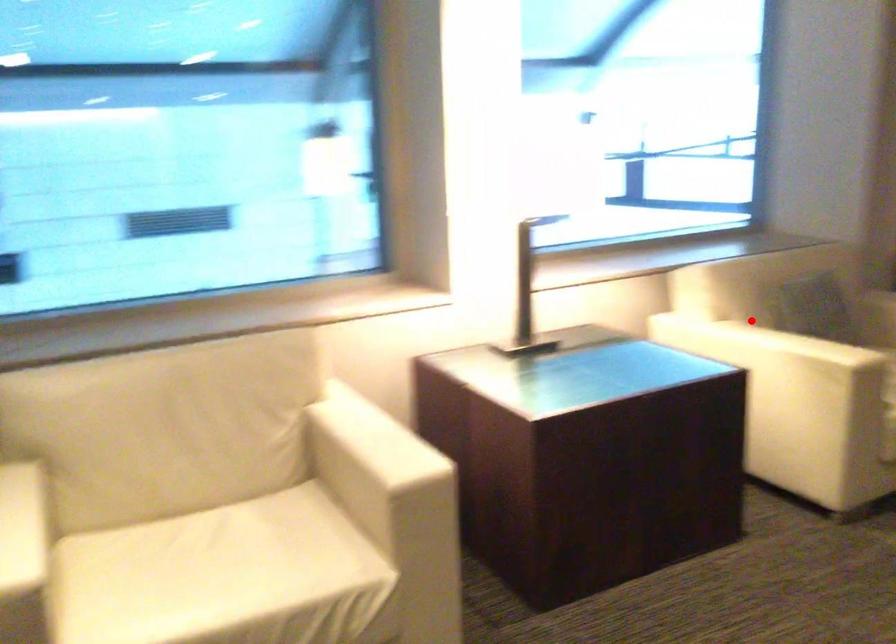
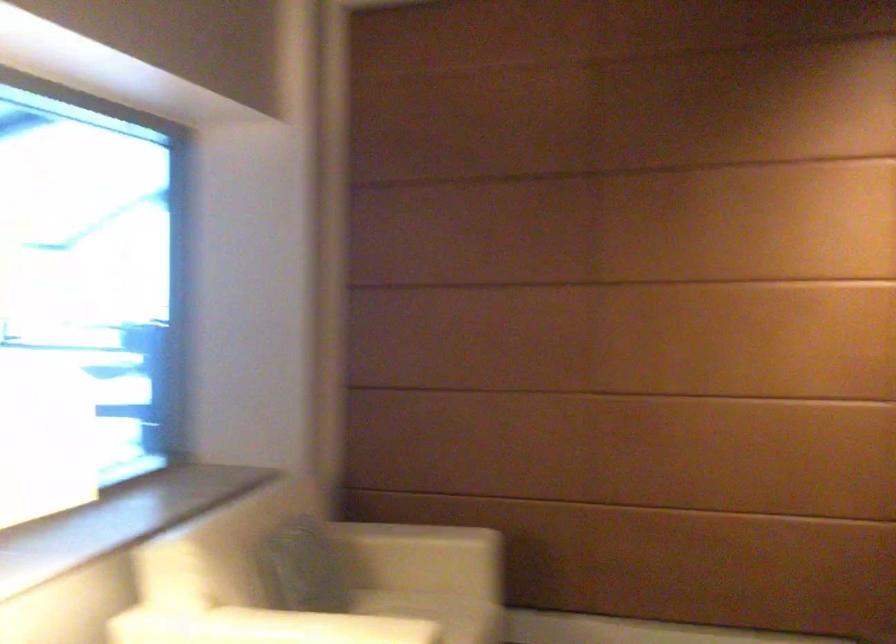
Where in the second image is the point corresponding to the highlighted location from the first image?

(285, 625)